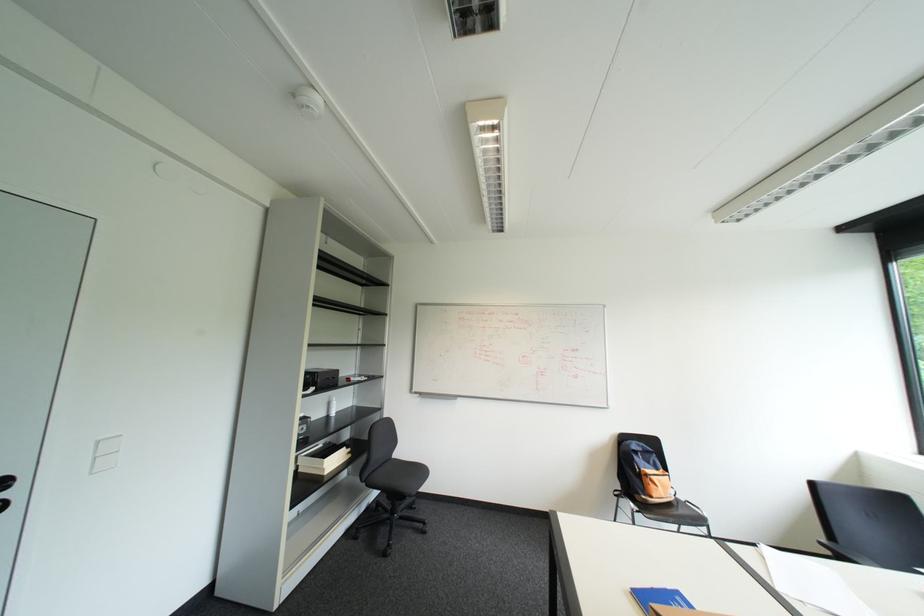
This screenshot has height=616, width=924. What do you see at coordinates (104, 454) in the screenshot? I see `the white light switch` at bounding box center [104, 454].